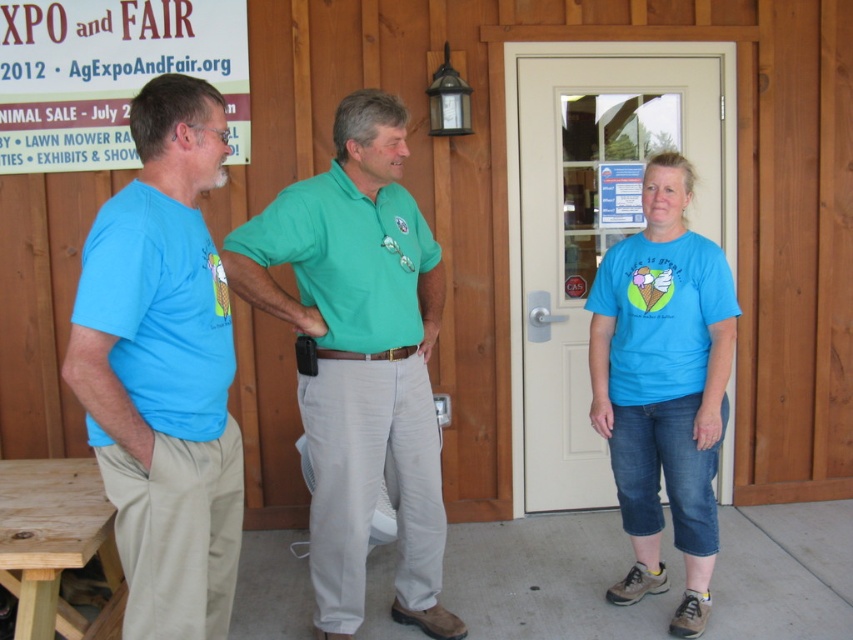
Is green cotton shirt at center positioned before wooden picnic table at lower left?

No, green cotton shirt at center is behind wooden picnic table at lower left.

Is green cotton shirt at center to the right of wooden picnic table at lower left from the viewer's perspective?

Correct, you'll find green cotton shirt at center to the right of wooden picnic table at lower left.

What are the coordinates of `green cotton shirt at center` in the screenshot? It's located at (360, 358).

In order to click on matte blue t-shirt at center in this screenshot , I will do coord(663,385).

This screenshot has width=853, height=640. What do you see at coordinates (663, 385) in the screenshot?
I see `matte blue t-shirt at center` at bounding box center [663, 385].

This screenshot has height=640, width=853. I want to click on matte blue t-shirt at center, so click(663, 385).

Does point (194, 563) come in front of point (379, 237)?

Yes.

Image resolution: width=853 pixels, height=640 pixels. Describe the element at coordinates (163, 369) in the screenshot. I see `matte blue t-shirt at left` at that location.

Where is `matte blue t-shirt at left`? Image resolution: width=853 pixels, height=640 pixels. matte blue t-shirt at left is located at coordinates (163, 369).